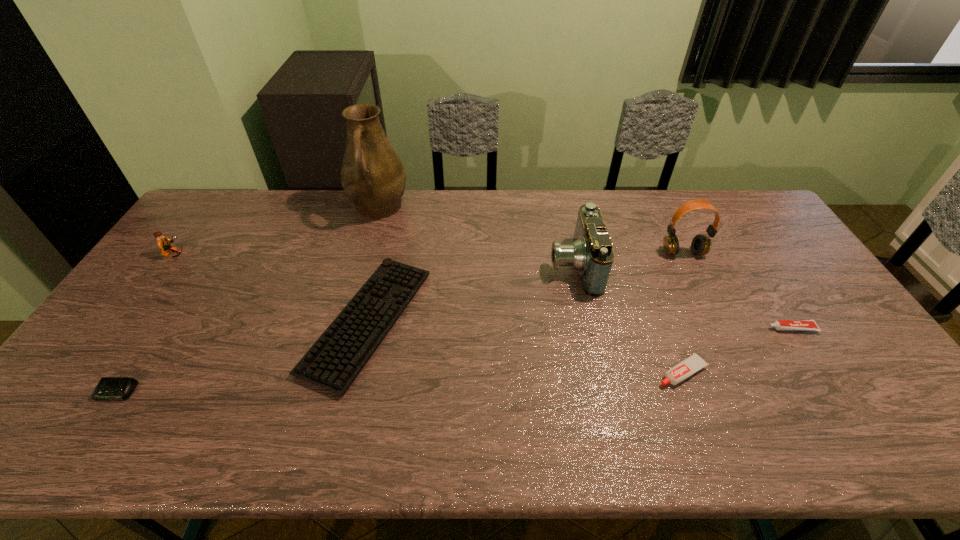
Identify the location of the farther toothpaste. This screenshot has height=540, width=960. (808, 325).

This screenshot has height=540, width=960. Identify the location of the right toothpaste. (808, 325).

In order to click on alarm clock in this screenshot , I will do `click(108, 388)`.

Locate an element on the screen. This screenshot has height=540, width=960. vacant space situated 0.100m on the handle side of the farthest object is located at coordinates (368, 250).

Where is `vacant region located on the ear cups of the seventh object from left to right`? This screenshot has width=960, height=540. vacant region located on the ear cups of the seventh object from left to right is located at coordinates (699, 285).

The width and height of the screenshot is (960, 540). Identify the location of vacant space located on the front-facing side of the fourth object from right to left. (462, 265).

At what (x,y) coordinates should I click in order to perform the action: click on vacant space situated 0.320m on the front-facing side of the fourth object from right to left. Please return your answer as a coordinate pair (x, y). Looking at the image, I should click on (446, 265).

Identify the location of free location located on the front-facing side of the fourth object from right to left. (471, 265).

This screenshot has width=960, height=540. In order to click on free space located 0.260m holding a crossbow in the hands of the fifth shortest object in this screenshot , I will do `click(268, 255)`.

I want to click on free region located 0.050m on the front of the computer keyboard, so click(x=346, y=418).